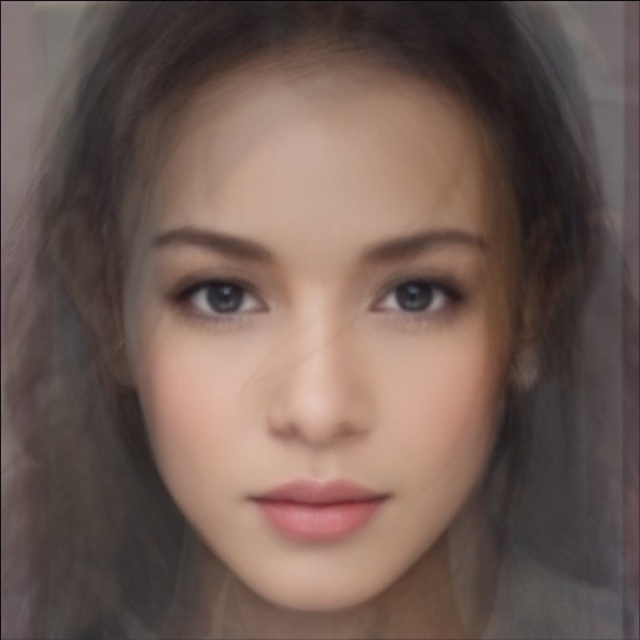
Question: Considering the real-world distances, which object is farthest from the brown smooth eyebrow at upper center?

Choices:
 (A) brown smooth eyebrow at center
 (B) blue glossy eye at center

Answer: (B)

Question: Can you confirm if smooth skin face at center is positioned above matte brown eye at center?

Choices:
 (A) no
 (B) yes

Answer: (A)

Question: Which is nearer to the blue glossy eye at center?

Choices:
 (A) smooth skin face at center
 (B) matte brown eye at center

Answer: (A)

Question: Can you confirm if smooth skin face at center is positioned to the right of matte brown eye at center?

Choices:
 (A) yes
 (B) no

Answer: (B)

Question: Which point is farther to the camera?

Choices:
 (A) smooth skin face at center
 (B) blue glossy eye at center
 (C) brown smooth eyebrow at upper center
 (D) matte brown eye at center

Answer: (D)

Question: Where is blue glossy eye at center located in relation to brown smooth eyebrow at upper center in the image?

Choices:
 (A) right
 (B) left

Answer: (B)